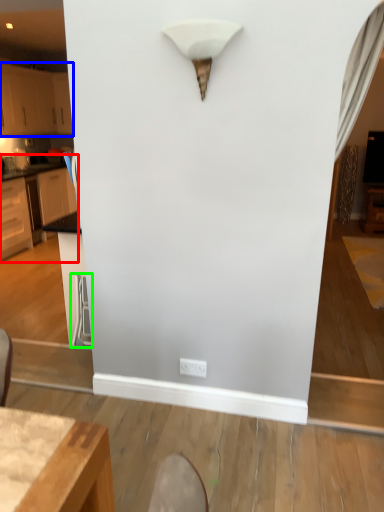
Question: Which is farther away from cabinetry (highlighted by a red box)? cabinetry (highlighted by a blue box) or swivel chair (highlighted by a green box)?

Choices:
 (A) cabinetry
 (B) swivel chair

Answer: (B)